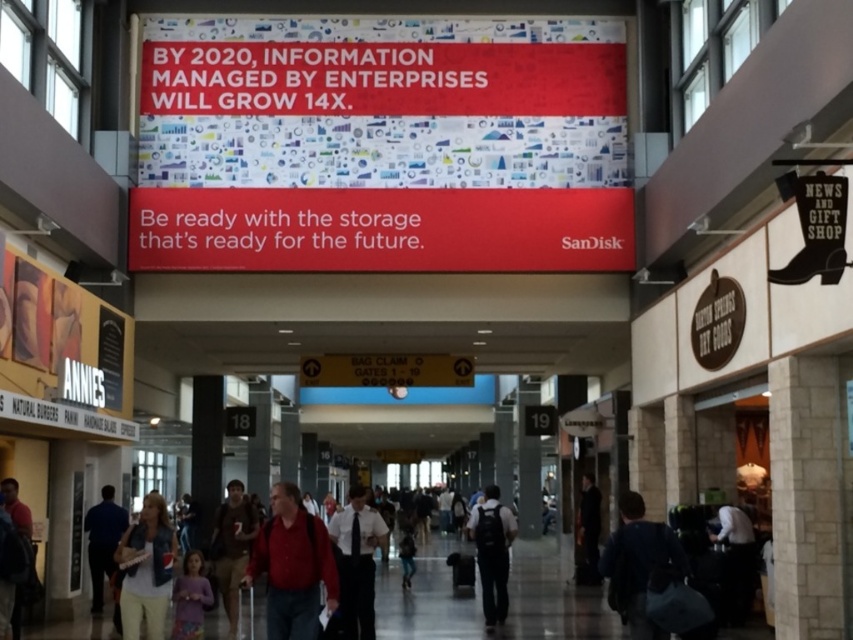
Who is taller, dark blue backpack at center or dark blue shirt at lower left?

Standing taller between the two is dark blue backpack at center.

Does dark blue backpack at center have a greater height compared to dark blue shirt at lower left?

Indeed, dark blue backpack at center has a greater height compared to dark blue shirt at lower left.

Is point (512, 529) closer to viewer compared to point (119, 506)?

Yes, point (512, 529) is in front of point (119, 506).

I want to click on dark blue backpack at center, so (492, 552).

Which is in front, point (624, 605) or point (96, 564)?

Point (624, 605) is in front.

The height and width of the screenshot is (640, 853). What do you see at coordinates (637, 563) in the screenshot?
I see `dark blue backpack at lower right` at bounding box center [637, 563].

The width and height of the screenshot is (853, 640). I want to click on dark blue backpack at lower right, so click(637, 563).

Does white shirt at center appear on the left side of matte purple shirt at lower left?

In fact, white shirt at center is to the right of matte purple shirt at lower left.

Is white shirt at center bigger than matte purple shirt at lower left?

Yes, white shirt at center is bigger than matte purple shirt at lower left.

At what (x,y) coordinates should I click in order to perform the action: click on white shirt at center. Please return your answer as a coordinate pair (x, y). This screenshot has height=640, width=853. Looking at the image, I should click on (357, 561).